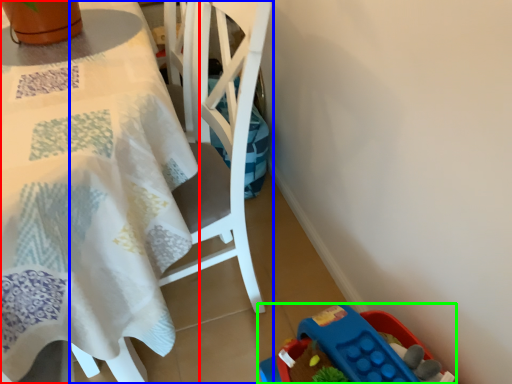
Question: Based on their relative distances, which object is farther from table (highlighted by a red box)? Choose from chair (highlighted by a blue box) and toy (highlighted by a green box).

Choices:
 (A) chair
 (B) toy

Answer: (B)